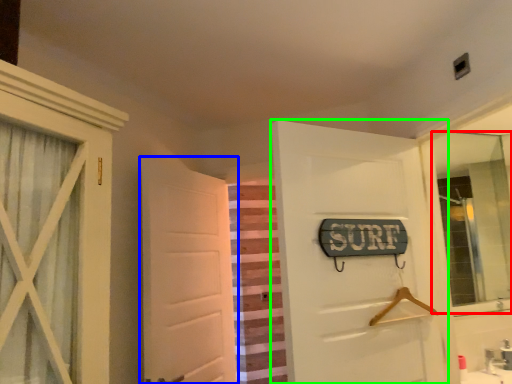
Question: Which object is positioned closest to mirror (highlighted by a red box)? Select from door (highlighted by a blue box) and door (highlighted by a green box).

Choices:
 (A) door
 (B) door

Answer: (B)